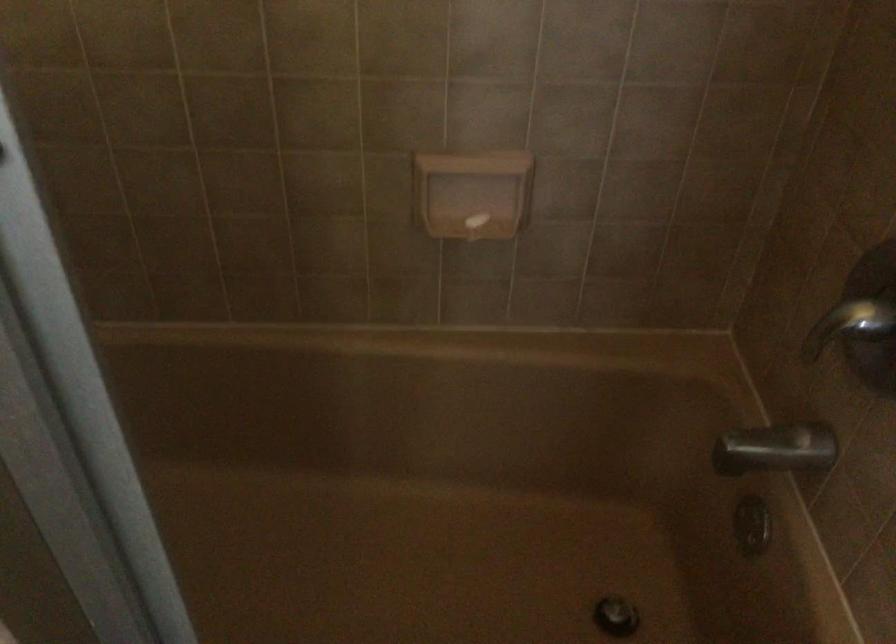
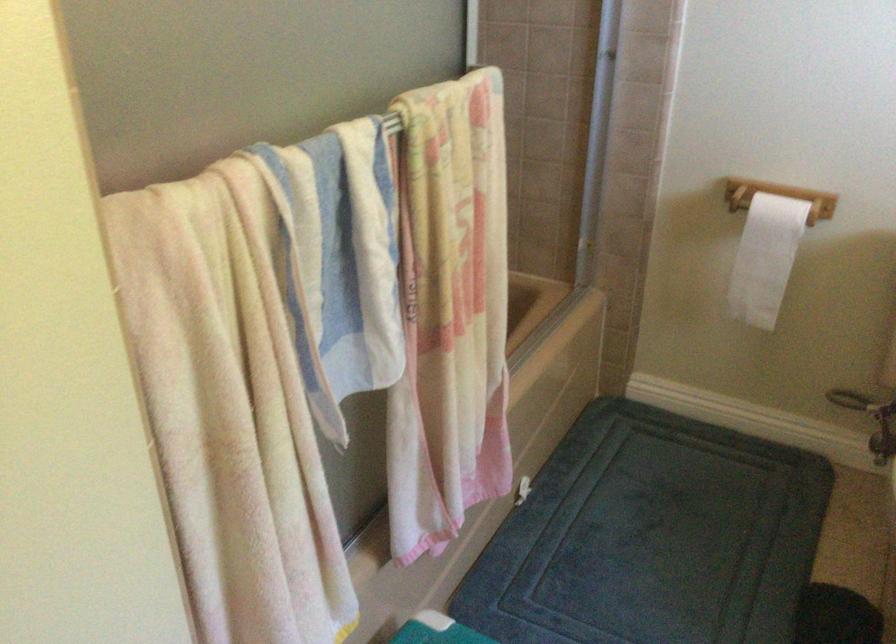
Question: I am providing you with two images of the same scene from different viewpoints. After the viewpoint changes to image2, which objects are now occluded?

Choices:
 (A) black desk speaker
 (B) metal shower handle
 (C) white toilet paper
 (D) white bar of soap

Answer: (D)